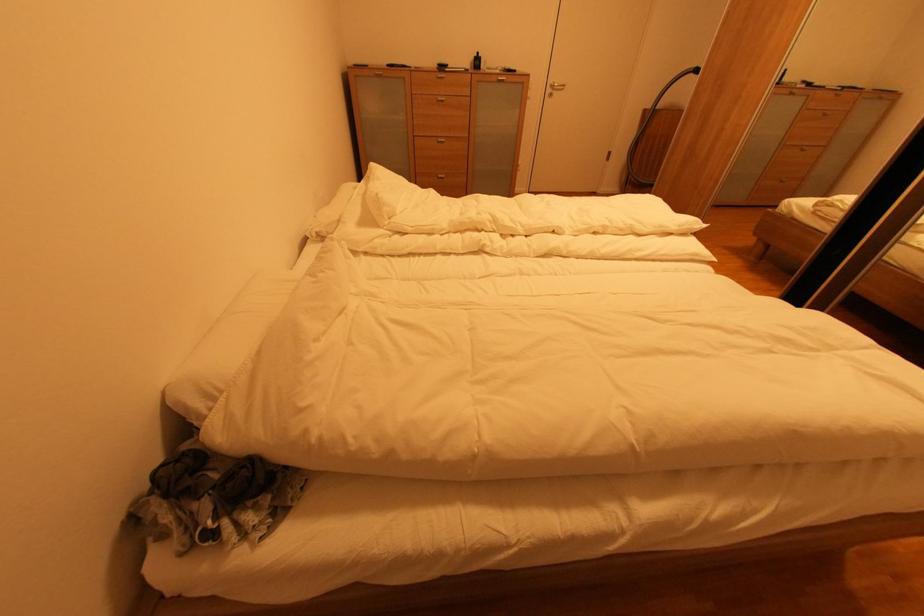
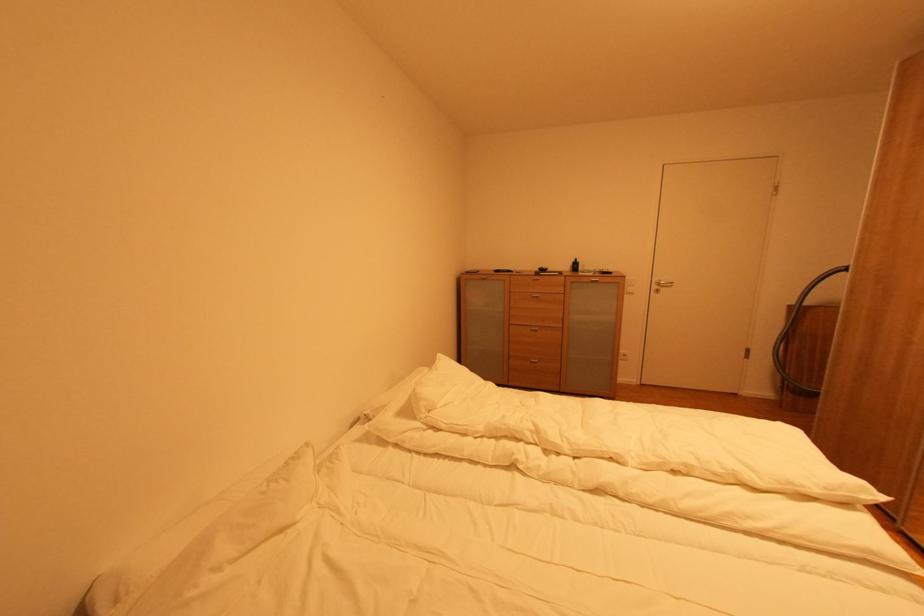
In the second image, find the point that corresponds to point (554, 92) in the first image.

(661, 289)